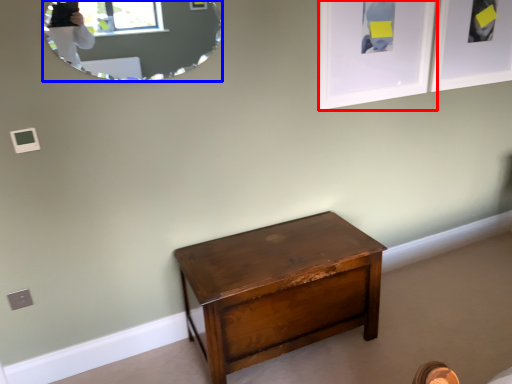
Question: Which object is further to the camera taking this photo, picture frame (highlighted by a red box) or mirror (highlighted by a blue box)?

Choices:
 (A) picture frame
 (B) mirror

Answer: (A)